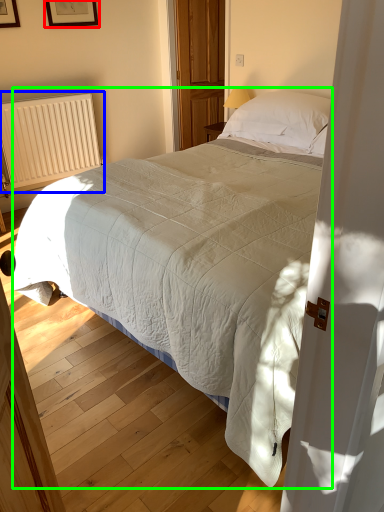
Question: Based on their relative distances, which object is farther from picture frame (highlighted by a red box)? Choose from radiator (highlighted by a blue box) and bed (highlighted by a green box).

Choices:
 (A) radiator
 (B) bed

Answer: (B)